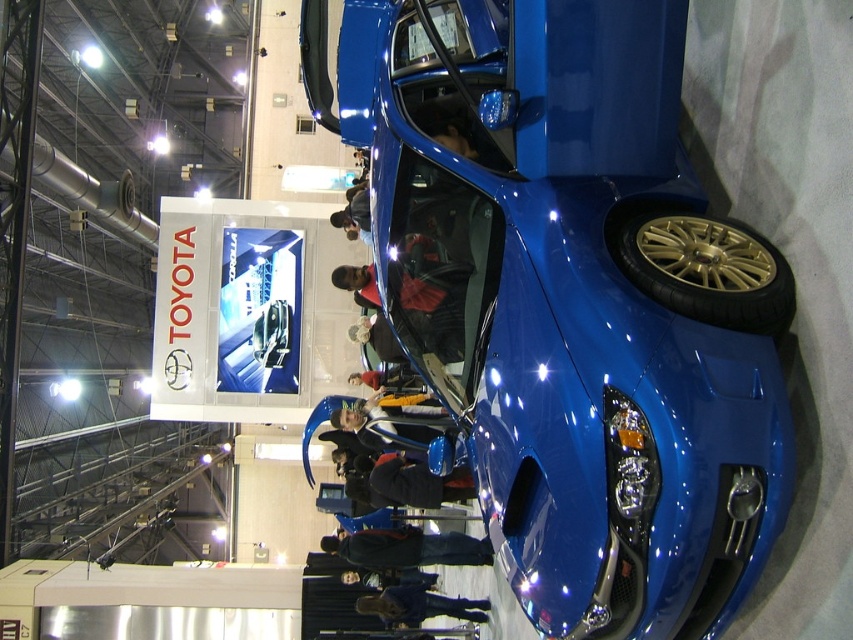
How far apart are shiny blue car at center and gold metallic tire at lower right?

shiny blue car at center and gold metallic tire at lower right are 25.63 inches apart from each other.

Who is more distant from viewer, (x=605, y=547) or (x=634, y=262)?

The point (x=634, y=262) is more distant.

Is point (339, 54) positioned before point (770, 268)?

No, it is not.

Locate an element on the screen. This screenshot has height=640, width=853. shiny blue car at center is located at coordinates (572, 298).